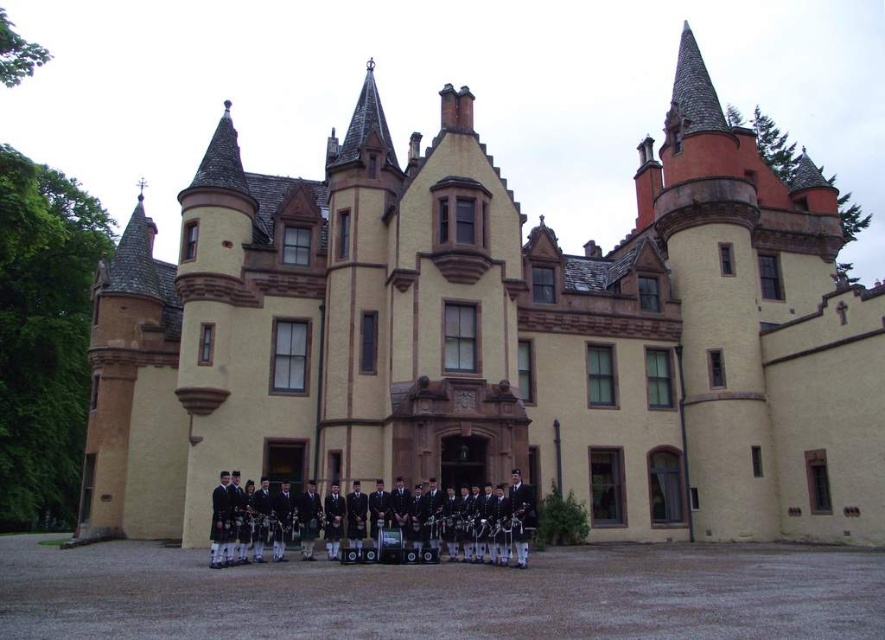
Question: Among these points, which one is nearest to the camera?

Choices:
 (A) click(x=329, y=536)
 (B) click(x=281, y=552)

Answer: (B)

Question: Can you confirm if black wool kilt at center is positioned below dark blue wool kilt at center?

Choices:
 (A) no
 (B) yes

Answer: (B)

Question: Which point is closer to the camera?

Choices:
 (A) dark blue wool kilt at center
 (B) black wool kilt at center

Answer: (B)

Question: Where is black wool kilt at center located in relation to dark blue wool kilt at center in the image?

Choices:
 (A) left
 (B) right

Answer: (B)

Question: Which of the following is the closest to the observer?

Choices:
 (A) (472, 557)
 (B) (335, 497)

Answer: (A)

Question: Does black wool kilt at center have a lesser width compared to dark blue wool kilt at center?

Choices:
 (A) no
 (B) yes

Answer: (A)